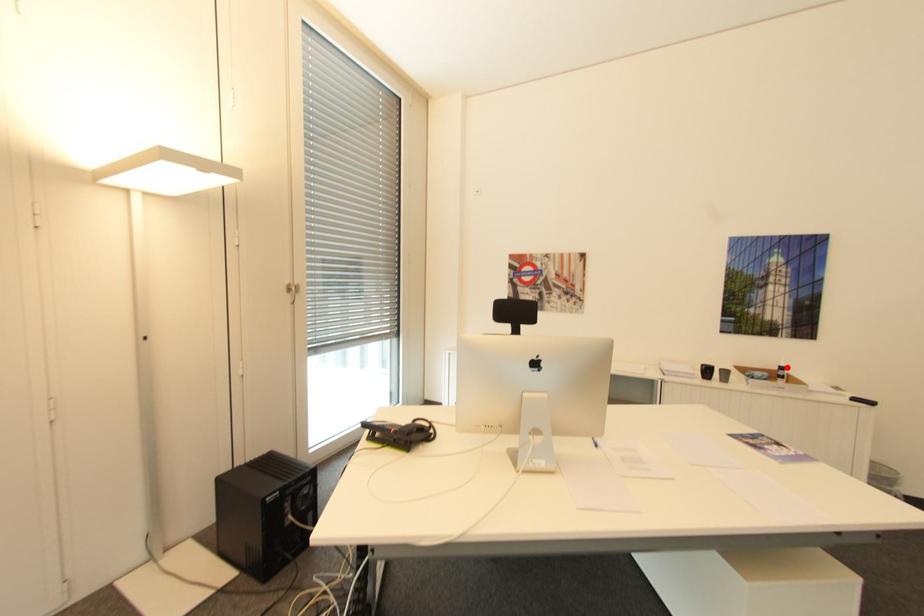
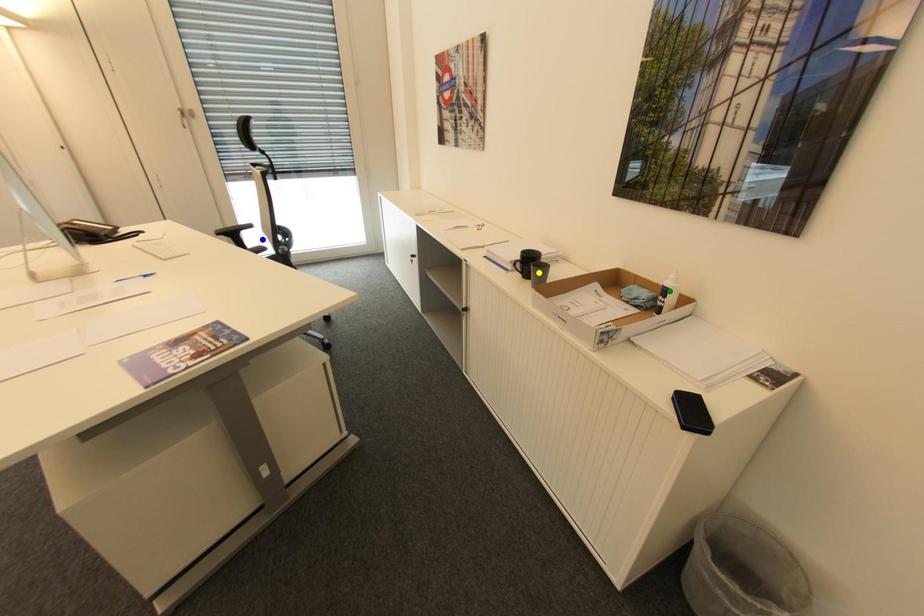
Question: I am providing you with two images of the same scene from different viewpoints. A red point is marked on the first image. You are given multiple points on the second image. Which spot in image 2 lines up with the point in image 1?

Choices:
 (A) blue point
 (B) green point
 (C) yellow point

Answer: (B)